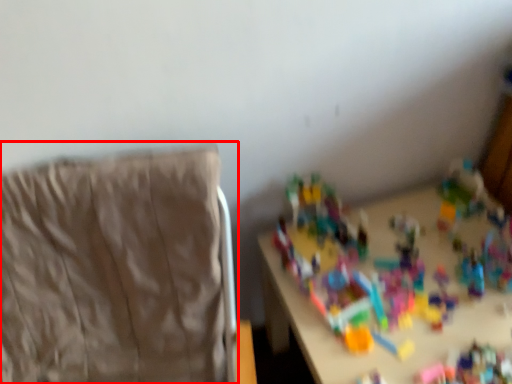
Question: From the image, what is the correct spatial relationship of furniture (annotated by the red box) in relation to toy?

Choices:
 (A) left
 (B) right

Answer: (A)